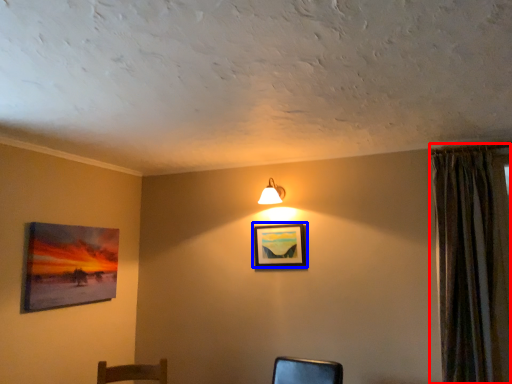
Question: Which object is further to the camera taking this photo, curtain (highlighted by a red box) or picture frame (highlighted by a blue box)?

Choices:
 (A) curtain
 (B) picture frame

Answer: (B)